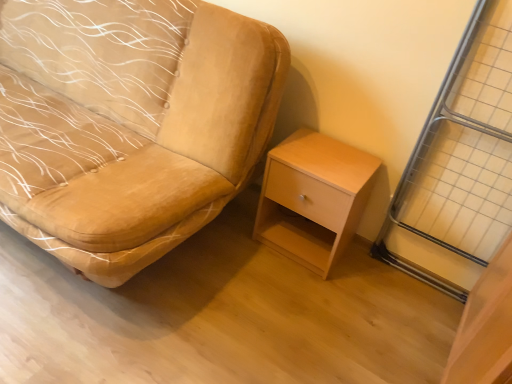
The width and height of the screenshot is (512, 384). Describe the element at coordinates (129, 124) in the screenshot. I see `velvet beige chair at center` at that location.

Find the location of a particular element. Image resolution: width=512 pixels, height=384 pixels. velvet beige chair at center is located at coordinates (129, 124).

The image size is (512, 384). I want to click on light wood/finely finished nightstand at lower right, so tap(313, 198).

Would you say velvet beige chair at center is a long distance from metallic silver screen door at right?

Yes, velvet beige chair at center and metallic silver screen door at right are located far from each other.

Is velvet beige chair at center positioned beyond the bounds of metallic silver screen door at right?

Yes, velvet beige chair at center is located beyond the bounds of metallic silver screen door at right.

Considering the sizes of objects velvet beige chair at center and metallic silver screen door at right in the image provided, who is thinner, velvet beige chair at center or metallic silver screen door at right?

metallic silver screen door at right is thinner.

Between velvet beige chair at center and metallic silver screen door at right, which one has less height?

With less height is velvet beige chair at center.

Looking at this image, which is more to the right, light wood/finely finished nightstand at lower right or velvet beige chair at center?

Positioned to the right is light wood/finely finished nightstand at lower right.

Is point (310, 146) closer or farther from the camera than point (196, 79)?

Point (310, 146) appears to be farther away from the viewer than point (196, 79).

Is velvet beige chair at center inside light wood/finely finished nightstand at lower right?

Actually, velvet beige chair at center is outside light wood/finely finished nightstand at lower right.

Who is bigger, light wood/finely finished nightstand at lower right or velvet beige chair at center?

velvet beige chair at center.

From the picture: Is metallic silver screen door at right spatially inside velvet beige chair at center, or outside of it?

metallic silver screen door at right cannot be found inside velvet beige chair at center.

Is metallic silver screen door at right oriented away from velvet beige chair at center?

No, metallic silver screen door at right's orientation is not away from velvet beige chair at center.

From the image's perspective, which one is positioned higher, metallic silver screen door at right or velvet beige chair at center?

velvet beige chair at center appears higher in the image.

Is metallic silver screen door at right to the left or to the right of velvet beige chair at center in the image?

In the image, metallic silver screen door at right appears on the right side of velvet beige chair at center.

Is light wood/finely finished nightstand at lower right looking in the opposite direction of metallic silver screen door at right?

No, light wood/finely finished nightstand at lower right's orientation is not away from metallic silver screen door at right.

Which point is more forward, (293, 183) or (438, 164)?

The point (438, 164) is closer.

Image resolution: width=512 pixels, height=384 pixels. What are the coordinates of `nightstand below the metallic silver screen door at right (from the image's perspective)` in the screenshot? It's located at (313, 198).

Can you tell me how much light wood/finely finished nightstand at lower right and metallic silver screen door at right differ in facing direction?

0.0396 degrees.

Which is more to the left, velvet beige chair at center or light wood/finely finished nightstand at lower right?

velvet beige chair at center is more to the left.

Considering the sizes of objects velvet beige chair at center and light wood/finely finished nightstand at lower right in the image provided, who is thinner, velvet beige chair at center or light wood/finely finished nightstand at lower right?

With smaller width is light wood/finely finished nightstand at lower right.

From a real-world perspective, which is physically below, velvet beige chair at center or light wood/finely finished nightstand at lower right?

light wood/finely finished nightstand at lower right, from a real-world perspective.

Consider the image. Could light wood/finely finished nightstand at lower right be considered to be inside velvet beige chair at center?

Definitely not — light wood/finely finished nightstand at lower right is not inside velvet beige chair at center.

Who is smaller, metallic silver screen door at right or light wood/finely finished nightstand at lower right?

Smaller between the two is metallic silver screen door at right.

From the image's perspective, is metallic silver screen door at right located above or below light wood/finely finished nightstand at lower right?

Based on their image positions, metallic silver screen door at right is located above light wood/finely finished nightstand at lower right.

Considering the points (500, 70) and (284, 174), which point is behind, point (500, 70) or point (284, 174)?

The point (284, 174) is behind.

You are a GUI agent. You are given a task and a screenshot of the screen. Output one action in this format:
    pyautogui.click(x=<x>, y=<y>)
    Task: Click on the screen door on the right of velvet beige chair at center
    
    Given the screenshot: What is the action you would take?
    pyautogui.click(x=462, y=155)

I want to click on chair that is in front of the light wood/finely finished nightstand at lower right, so click(x=129, y=124).

Based on their spatial positions, is light wood/finely finished nightstand at lower right or velvet beige chair at center closer to metallic silver screen door at right?

Among the two, light wood/finely finished nightstand at lower right is located nearer to metallic silver screen door at right.

Based on their spatial positions, is velvet beige chair at center or light wood/finely finished nightstand at lower right further from metallic silver screen door at right?

Among the two, velvet beige chair at center is located further to metallic silver screen door at right.

Which object lies further to the anchor point velvet beige chair at center, light wood/finely finished nightstand at lower right or metallic silver screen door at right?

The object further to velvet beige chair at center is metallic silver screen door at right.

Which object lies further to the anchor point light wood/finely finished nightstand at lower right, metallic silver screen door at right or velvet beige chair at center?

velvet beige chair at center is positioned further to the anchor light wood/finely finished nightstand at lower right.

When comparing their distances from light wood/finely finished nightstand at lower right, does velvet beige chair at center or metallic silver screen door at right seem closer?

metallic silver screen door at right is closer to light wood/finely finished nightstand at lower right.

Estimate the real-world distances between objects in this image. Which object is further from velvet beige chair at center, metallic silver screen door at right or light wood/finely finished nightstand at lower right?

metallic silver screen door at right is further to velvet beige chair at center.

You are a GUI agent. You are given a task and a screenshot of the screen. Output one action in this format:
    pyautogui.click(x=<x>, y=<y>)
    Task: Click on the nightstand situated between velvet beige chair at center and metallic silver screen door at right from left to right
    This screenshot has width=512, height=384.
    Given the screenshot: What is the action you would take?
    pyautogui.click(x=313, y=198)